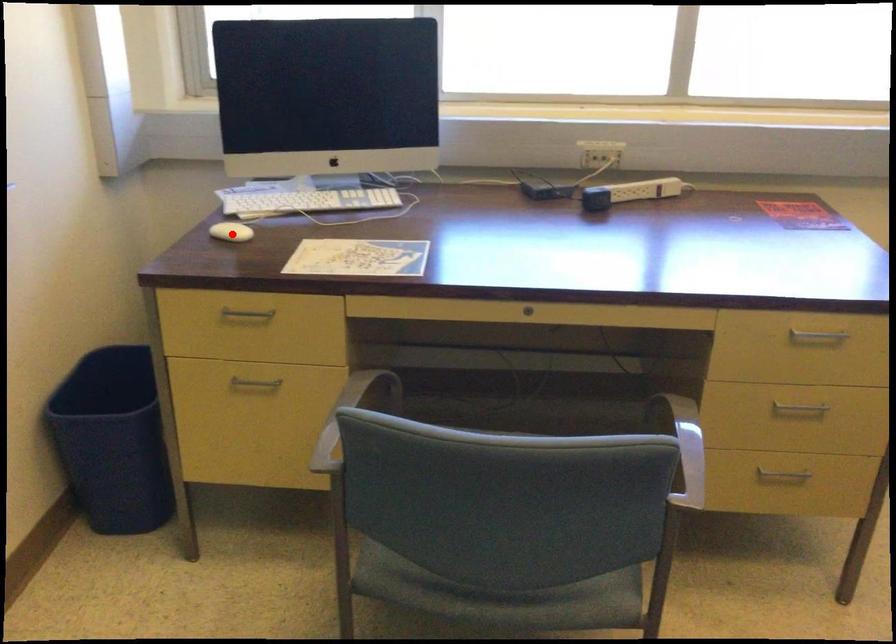
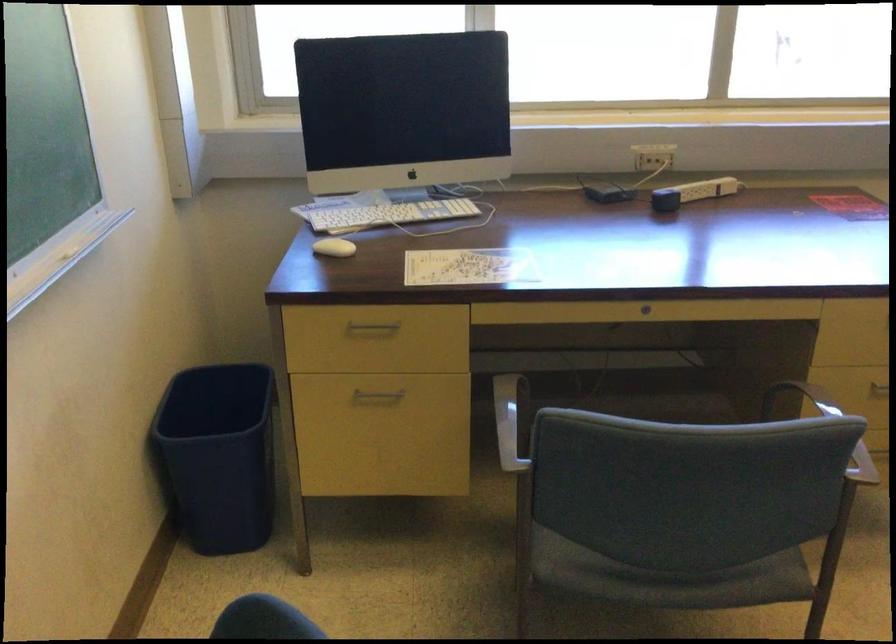
In the second image, find the point that corresponds to the highlighted location in the first image.

(333, 247)